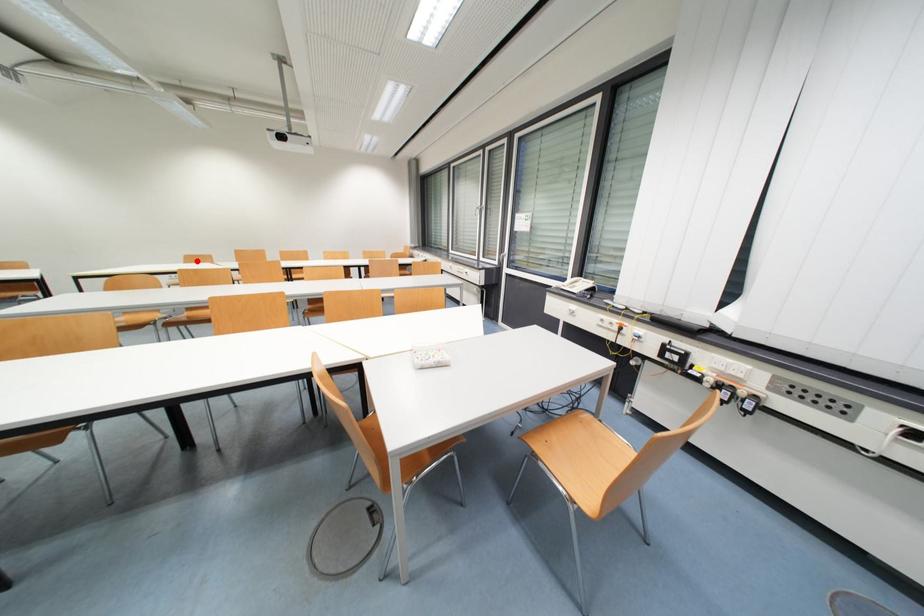
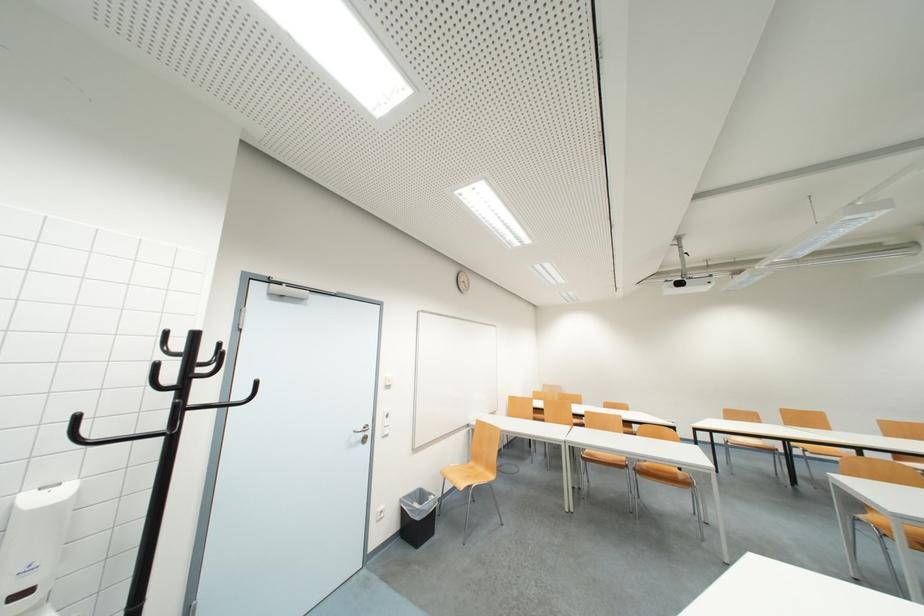
Question: I am providing you with two images of the same scene from different viewpoints. A red point is shown in image1. For the corresponding object point in image2, is it positioned nearer or farther from the camera?

Choices:
 (A) Nearer
 (B) Farther

Answer: (A)